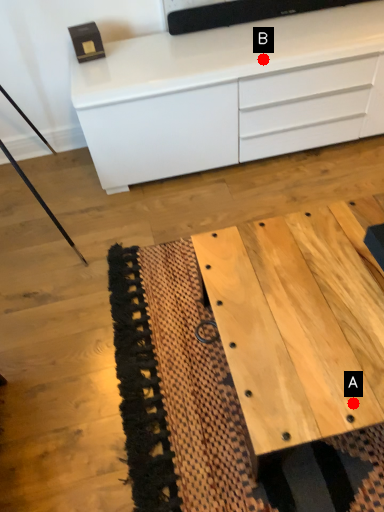
Question: Two points are circled on the image, labeled by A and B beside each circle. Which of the following is the farthest from the observer?

Choices:
 (A) A is further
 (B) B is further

Answer: (B)